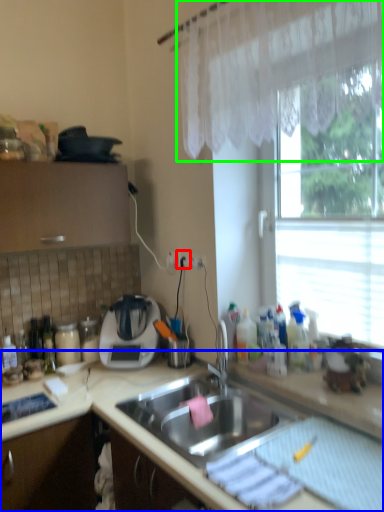
Question: Which object is the closest to the electric outlet (highlighted by a red box)? Choose among these: countertop (highlighted by a blue box) or curtain (highlighted by a green box).

Choices:
 (A) countertop
 (B) curtain

Answer: (A)